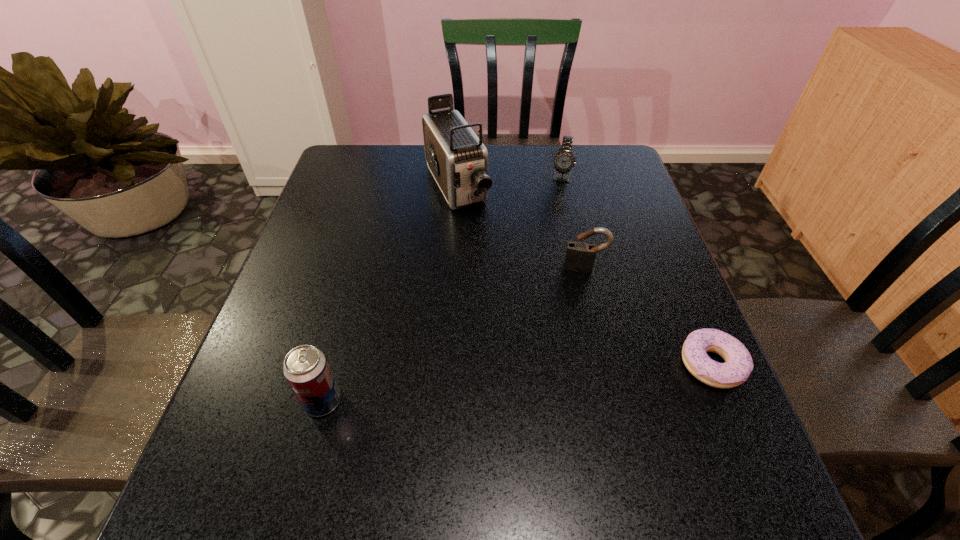
The width and height of the screenshot is (960, 540). I want to click on vacant space located 0.120m on the face of the watch, so pos(555,212).

Find the location of `blank space located on the face of the watch`. blank space located on the face of the watch is located at coordinates (551, 235).

Where is `vacant space positioned 0.310m with the keyhole on the front of the third farthest object`? vacant space positioned 0.310m with the keyhole on the front of the third farthest object is located at coordinates (572, 386).

Locate an element on the screen. The image size is (960, 540). vacant region located 0.110m with the keyhole on the front of the third farthest object is located at coordinates (578, 307).

Identify the location of free space located with the keyhole on the front of the third farthest object. The width and height of the screenshot is (960, 540). (576, 336).

You are a GUI agent. You are given a task and a screenshot of the screen. Output one action in this format:
    pyautogui.click(x=<x>, y=<y>)
    Task: Click on the vacant region located 0.150m at the lens of the second object from left to right
    The height and width of the screenshot is (540, 960).
    Given the screenshot: What is the action you would take?
    pyautogui.click(x=489, y=253)

Find the location of a particular element. This screenshot has width=960, height=540. free space located at the lens of the second object from left to right is located at coordinates (508, 286).

Image resolution: width=960 pixels, height=540 pixels. Find the location of `free space located 0.220m at the lens of the second object from left to right`. free space located 0.220m at the lens of the second object from left to right is located at coordinates (499, 272).

Locate an element on the screen. This screenshot has height=540, width=960. watch that is at the far edge is located at coordinates (564, 160).

Identify the location of camcorder that is at the far edge. (458, 160).